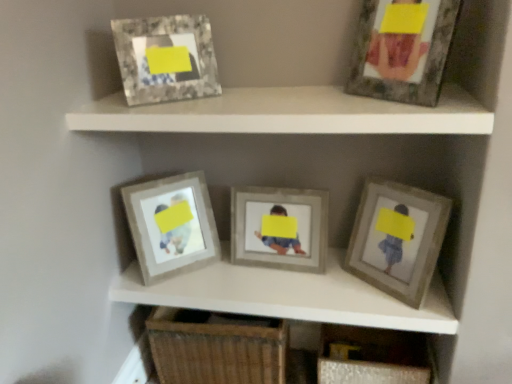
Where is `matte gray frame at upper right, which ranks as the 2th picture frame in right-to-left order`? The height and width of the screenshot is (384, 512). matte gray frame at upper right, which ranks as the 2th picture frame in right-to-left order is located at coordinates point(402,49).

Measure the distance between point (273, 355) and camera.

Point (273, 355) is 5.04 feet from camera.

Find the location of a particular element. The image size is (512, 384). wooden frame at center, the 5th picture frame when ordered from right to left is located at coordinates (170, 225).

From the image's perspective, would you say woven wood drawer at lower center is shown under matte gray frame at upper center?

Yes, from the image's perspective, woven wood drawer at lower center is beneath matte gray frame at upper center.

From a real-world perspective, relative to matte gray frame at upper center, is woven wood drawer at lower center vertically above or below?

woven wood drawer at lower center is situated lower than matte gray frame at upper center in the real world.

Is matte gray frame at upper center located within woven wood drawer at lower center?

No, matte gray frame at upper center is not inside woven wood drawer at lower center.

Considering the sizes of objects woven wood drawer at lower center and matte gray frame at upper center in the image provided, who is smaller, woven wood drawer at lower center or matte gray frame at upper center?

Smaller between the two is matte gray frame at upper center.

Can you tell me how much matte gray frame at center right, the 1th picture frame positioned from the right, and wooden frame at center, positioned as the first picture frame in left-to-right order, differ in facing direction?

The angle between the facing direction of matte gray frame at center right, the 1th picture frame positioned from the right, and the facing direction of wooden frame at center, positioned as the first picture frame in left-to-right order, is 82.1 degrees.

Is the surface of matte gray frame at center right, which appears as the fifth picture frame when viewed from the left, in direct contact with wooden frame at center, positioned as the first picture frame in left-to-right order?

matte gray frame at center right, which appears as the fifth picture frame when viewed from the left, is not next to wooden frame at center, positioned as the first picture frame in left-to-right order, and they're not touching.

Measure the distance from matte gray frame at center right, which appears as the fifth picture frame when viewed from the left, to wooden frame at center, positioned as the first picture frame in left-to-right order.

matte gray frame at center right, which appears as the fifth picture frame when viewed from the left, is 25.54 inches away from wooden frame at center, positioned as the first picture frame in left-to-right order.

Is matte gray frame at center right, which appears as the fifth picture frame when viewed from the left, aimed at wooden frame at center, positioned as the first picture frame in left-to-right order?

No.

From the picture: Considering the sizes of matte gray frame at upper right, marked as the fourth picture frame in a left-to-right arrangement, and woven wood drawer at lower center in the image, is matte gray frame at upper right, marked as the fourth picture frame in a left-to-right arrangement, taller or shorter than woven wood drawer at lower center?

Considering their sizes, matte gray frame at upper right, marked as the fourth picture frame in a left-to-right arrangement, has less height than woven wood drawer at lower center.

Which is behind, point (376, 14) or point (154, 335)?

The point (154, 335) is behind.

From a real-world perspective, does matte gray frame at upper right, which ranks as the 2th picture frame in right-to-left order, stand above woven wood drawer at lower center?

Yes.

Considering the relative positions of matte gray frame at upper right, which ranks as the 2th picture frame in right-to-left order, and woven wood drawer at lower center in the image provided, is matte gray frame at upper right, which ranks as the 2th picture frame in right-to-left order, to the left of woven wood drawer at lower center from the viewer's perspective?

In fact, matte gray frame at upper right, which ranks as the 2th picture frame in right-to-left order, is to the right of woven wood drawer at lower center.

From a real-world perspective, who is located higher, matte gray frame at center right, the 1th picture frame positioned from the right, or wooden frame at center, which ranks as the third picture frame in right-to-left order?

matte gray frame at center right, the 1th picture frame positioned from the right, is physically above.

Image resolution: width=512 pixels, height=384 pixels. There is a matte gray frame at center right, which appears as the fifth picture frame when viewed from the left. Identify the location of the 1st picture frame above it (from the image's perspective). (275, 237).

From the image's perspective, is matte gray frame at center right, the 1th picture frame positioned from the right, below wooden frame at center, which is the 3th picture frame from left to right?

Yes, from the image's perspective, matte gray frame at center right, the 1th picture frame positioned from the right, is beneath wooden frame at center, which is the 3th picture frame from left to right.

Is matte gray frame at center right, which appears as the fifth picture frame when viewed from the left, taller or shorter than wooden frame at center, which ranks as the third picture frame in right-to-left order?

In the image, matte gray frame at center right, which appears as the fifth picture frame when viewed from the left, appears to be shorter than wooden frame at center, which ranks as the third picture frame in right-to-left order.

Based on the photo, is woven wood drawer at lower center in front of or behind marble-like frame at upper left, positioned as the 4th picture frame in right-to-left order, in the image?

woven wood drawer at lower center is behind marble-like frame at upper left, positioned as the 4th picture frame in right-to-left order.

Which picture frame is the 3rd one when counting from the front of the woven wood drawer at lower center? Please provide its 2D coordinates.

[(166, 58)]

From a real-world perspective, which object stands above the other?

In real-world perspective, marble-like frame at upper left, the 2th picture frame viewed from the left, is above.

Does matte gray frame at center appear on the right side of matte gray frame at center right, which appears as the fifth picture frame when viewed from the left?

No, matte gray frame at center is not to the right of matte gray frame at center right, which appears as the fifth picture frame when viewed from the left.

Looking at this image, can you confirm if matte gray frame at center is bigger than matte gray frame at center right, which appears as the fifth picture frame when viewed from the left?

Yes, matte gray frame at center is bigger than matte gray frame at center right, which appears as the fifth picture frame when viewed from the left.

Is point (342, 281) closer to camera compared to point (362, 218)?

That is False.

How different are the orientations of matte gray frame at center and matte gray frame at center right, which appears as the fifth picture frame when viewed from the left, in degrees?

The angle between the facing direction of matte gray frame at center and the facing direction of matte gray frame at center right, which appears as the fifth picture frame when viewed from the left, is 39.2 degrees.

In the image, there is a matte gray frame at center. What are the coordinates of `drawer below it (from a real-world perspective)` in the screenshot? It's located at (216, 347).

Looking at this image, are woven wood drawer at lower center and matte gray frame at center located far from each other?

They are positioned close to each other.

Consider the image. Considering the sizes of objects woven wood drawer at lower center and matte gray frame at center in the image provided, who is smaller, woven wood drawer at lower center or matte gray frame at center?

With smaller size is matte gray frame at center.

Identify the location of drawer below the matte gray frame at upper center (from a real-world perspective). This screenshot has width=512, height=384. (216, 347).

Locate an element on the screen. the 4th picture frame counting from the left side of the matte gray frame at center right, the 1th picture frame positioned from the right is located at coordinates (170, 225).

Based on the photo, considering their positions, is marble-like frame at upper left, the 2th picture frame viewed from the left, positioned closer to matte gray frame at upper right, marked as the fourth picture frame in a left-to-right arrangement, than matte gray frame at upper center?

matte gray frame at upper center.

Considering their positions, is marble-like frame at upper left, the 2th picture frame viewed from the left, positioned further to wooden frame at center, which ranks as the third picture frame in right-to-left order, than woven wood drawer at lower center?

The object further to wooden frame at center, which ranks as the third picture frame in right-to-left order, is marble-like frame at upper left, the 2th picture frame viewed from the left.

Based on their spatial positions, is marble-like frame at upper left, positioned as the 4th picture frame in right-to-left order, or wooden frame at center, the 5th picture frame when ordered from right to left, further from wooden frame at center, which ranks as the third picture frame in right-to-left order?

Based on the image, marble-like frame at upper left, positioned as the 4th picture frame in right-to-left order, appears to be further to wooden frame at center, which ranks as the third picture frame in right-to-left order.

Considering their positions, is matte gray frame at center positioned further to matte gray frame at upper right, which ranks as the 2th picture frame in right-to-left order, than matte gray frame at center right, which appears as the fifth picture frame when viewed from the left?

matte gray frame at center lies further to matte gray frame at upper right, which ranks as the 2th picture frame in right-to-left order, than the other object.

Considering their positions, is matte gray frame at center right, which appears as the fifth picture frame when viewed from the left, positioned further to matte gray frame at upper right, marked as the fourth picture frame in a left-to-right arrangement, than marble-like frame at upper left, the 2th picture frame viewed from the left?

Based on the image, marble-like frame at upper left, the 2th picture frame viewed from the left, appears to be further to matte gray frame at upper right, marked as the fourth picture frame in a left-to-right arrangement.

Consider the image. Which object lies nearer to the anchor point marble-like frame at upper left, positioned as the 4th picture frame in right-to-left order, matte gray frame at center right, the 1th picture frame positioned from the right, or matte gray frame at upper center?

Based on the image, matte gray frame at upper center appears to be nearer to marble-like frame at upper left, positioned as the 4th picture frame in right-to-left order.

When comparing their distances from wooden frame at center, the 5th picture frame when ordered from right to left, does matte gray frame at upper center or matte gray frame at center seem closer?

matte gray frame at center lies closer to wooden frame at center, the 5th picture frame when ordered from right to left, than the other object.

When comparing their distances from wooden frame at center, which is the 3th picture frame from left to right, does wooden frame at center, the 5th picture frame when ordered from right to left, or matte gray frame at center right, the 1th picture frame positioned from the right, seem further?

The object further to wooden frame at center, which is the 3th picture frame from left to right, is wooden frame at center, the 5th picture frame when ordered from right to left.

At what (x,y) coordinates should I click in order to perform the action: click on cabinet between matte gray frame at upper center and woven wood drawer at lower center in the up-down direction. Please return your answer as a coordinate pair (x, y). Looking at the image, I should click on (289, 295).

You are a GUI agent. You are given a task and a screenshot of the screen. Output one action in this format:
    pyautogui.click(x=<x>, y=<y>)
    Task: Click on the cabinet situated between woven wood drawer at lower center and matte gray frame at center right, the 1th picture frame positioned from the right, from left to right
    
    Given the screenshot: What is the action you would take?
    pyautogui.click(x=289, y=295)

This screenshot has height=384, width=512. Find the location of `shelf between wooden frame at center, the 5th picture frame when ordered from right to left, and matte gray frame at upper right, marked as the fourth picture frame in a left-to-right arrangement, from left to right`. shelf between wooden frame at center, the 5th picture frame when ordered from right to left, and matte gray frame at upper right, marked as the fourth picture frame in a left-to-right arrangement, from left to right is located at coordinates (288, 114).

Find the location of a particular element. The image size is (512, 384). cabinet located between wooden frame at center, the 5th picture frame when ordered from right to left, and matte gray frame at upper right, which ranks as the 2th picture frame in right-to-left order, in the left-right direction is located at coordinates (289, 295).